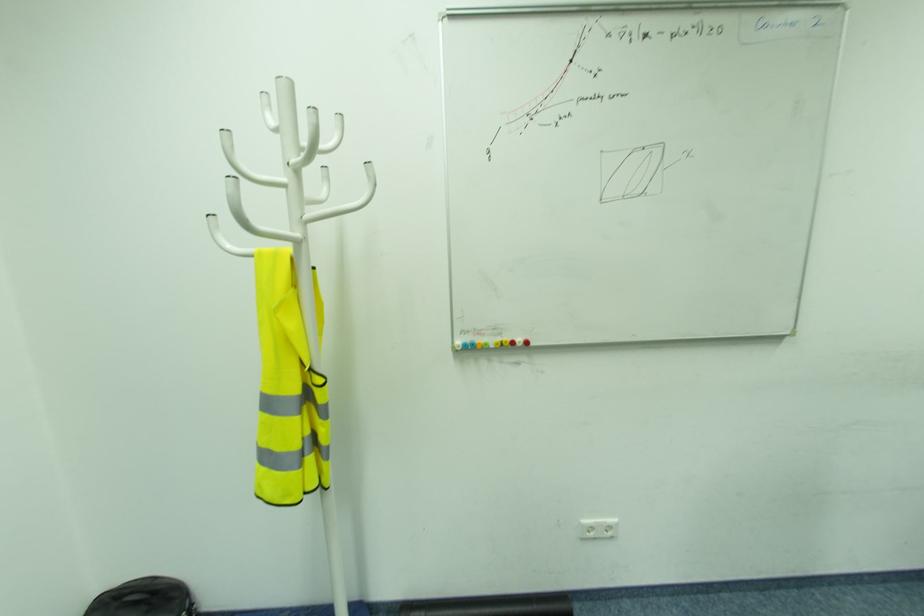
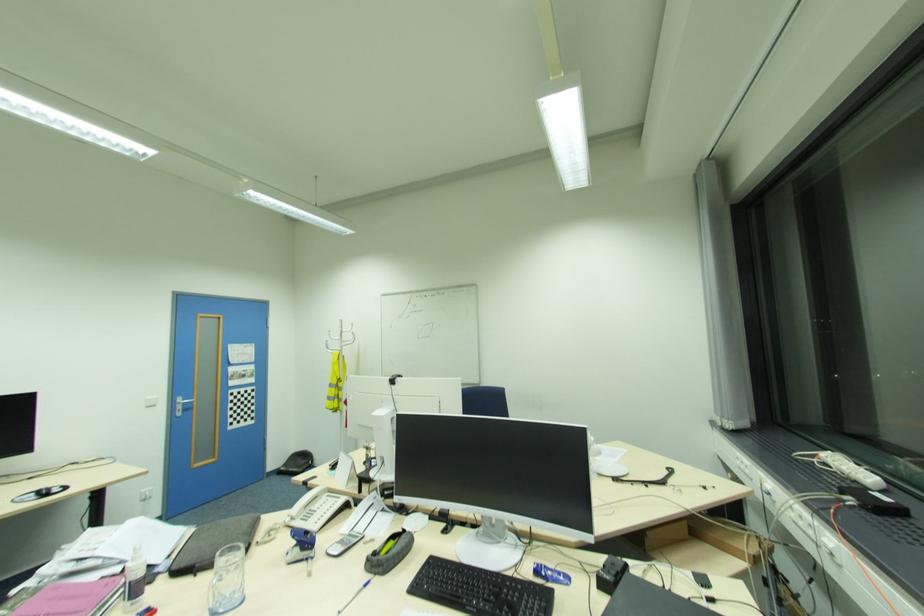
In a continuous first-person perspective shot, in which direction is the camera moving?

The cameraman moved toward right, backward.